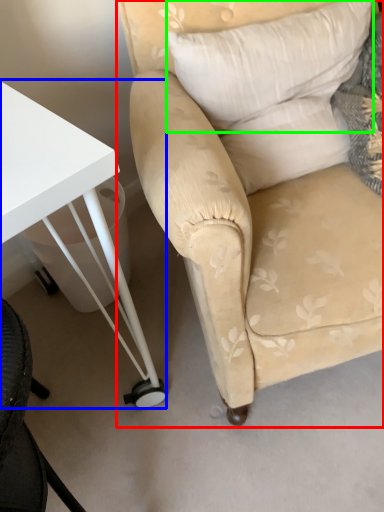
Question: Which object is the closest to the chair (highlighted by a red box)? Choose among these: table (highlighted by a blue box) or pillow (highlighted by a green box).

Choices:
 (A) table
 (B) pillow

Answer: (B)